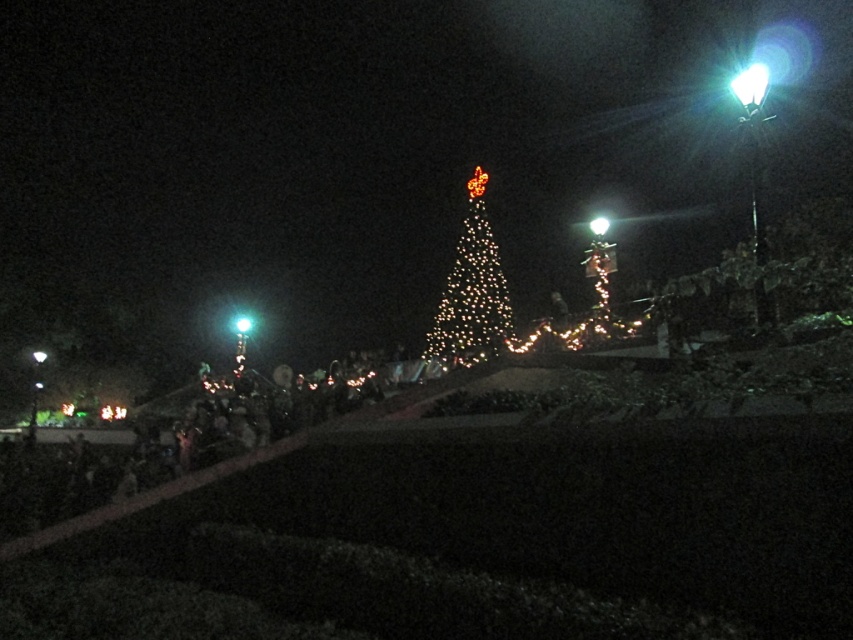
Question: Is white glass light at upper right wider than green glass light at center?

Choices:
 (A) no
 (B) yes

Answer: (B)

Question: Does illuminated plastic christmas tree at center appear on the right side of white plastic light at upper right?

Choices:
 (A) yes
 (B) no

Answer: (B)

Question: Considering the real-world distances, which object is closest to the illuminated plastic christmas tree at center?

Choices:
 (A) white plastic light at upper right
 (B) white glass light at upper right
 (C) green glass light at center

Answer: (B)

Question: Does white plastic light at upper right have a lesser width compared to green glass light at center?

Choices:
 (A) yes
 (B) no

Answer: (B)

Question: Which point is farther to the camera?

Choices:
 (A) white glass light at upper right
 (B) white plastic light at upper right

Answer: (A)

Question: Which is farther from the illuminated plastic christmas tree at center?

Choices:
 (A) green glass light at center
 (B) white plastic light at upper right
 (C) white glass light at upper right

Answer: (A)